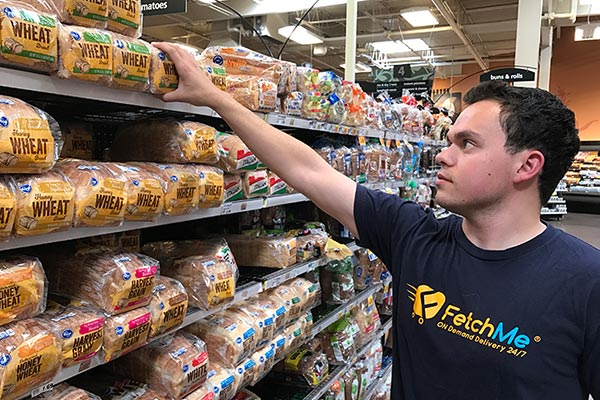
You are a GUI agent. You are given a task and a screenshot of the screen. Output one action in this format:
    pyautogui.click(x=<x>, y=<y>)
    Task: Click on the over head lights
    The height and width of the screenshot is (400, 600).
    Given the screenshot: What is the action you would take?
    pos(302,30), pos(423,16), pos(392,52), pos(342,65)